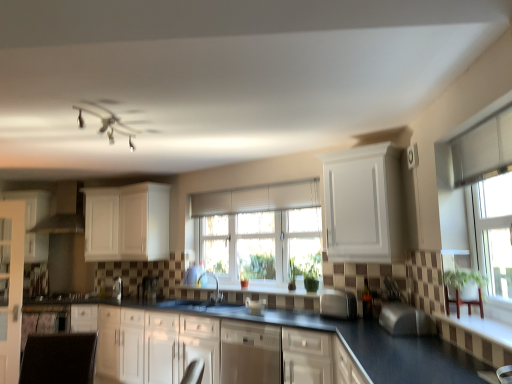
Question: Does satin black gas stove at lower left appear on the right side of satin silver toaster at center, positioned as the first appliance in back-to-front order?

Choices:
 (A) no
 (B) yes

Answer: (A)

Question: From a real-world perspective, is satin black gas stove at lower left on top of satin silver toaster at center, positioned as the first appliance in back-to-front order?

Choices:
 (A) no
 (B) yes

Answer: (A)

Question: From the image's perspective, is satin black gas stove at lower left beneath satin silver toaster at center, positioned as the first appliance in back-to-front order?

Choices:
 (A) yes
 (B) no

Answer: (A)

Question: Can you confirm if satin black gas stove at lower left is smaller than satin silver toaster at center, positioned as the first appliance in back-to-front order?

Choices:
 (A) yes
 (B) no

Answer: (B)

Question: Considering the relative sizes of satin black gas stove at lower left and satin silver toaster at center, positioned as the first appliance in back-to-front order, in the image provided, is satin black gas stove at lower left shorter than satin silver toaster at center, positioned as the first appliance in back-to-front order,?

Choices:
 (A) no
 (B) yes

Answer: (B)

Question: Could you tell me if satin black gas stove at lower left is facing satin silver toaster at center, which is counted as the first appliance, starting from the left?

Choices:
 (A) yes
 (B) no

Answer: (B)

Question: Is satin nickel faucet at center positioned in front of clear glass window at upper right, the first window positioned from the front?

Choices:
 (A) yes
 (B) no

Answer: (B)

Question: Is satin nickel faucet at center directly adjacent to clear glass window at upper right, which appears as the 1th window when viewed from the right?

Choices:
 (A) no
 (B) yes

Answer: (A)

Question: Can we say satin nickel faucet at center lies outside clear glass window at upper right, which appears as the 1th window when viewed from the right?

Choices:
 (A) yes
 (B) no

Answer: (A)

Question: Are satin nickel faucet at center and clear glass window at upper right, which is counted as the 2th window, starting from the left, far apart?

Choices:
 (A) no
 (B) yes

Answer: (B)

Question: From the image's perspective, is satin nickel faucet at center on top of clear glass window at upper right, the first window positioned from the front?

Choices:
 (A) yes
 (B) no

Answer: (B)

Question: From a real-world perspective, is satin nickel faucet at center below clear glass window at upper right, the first window positioned from the front?

Choices:
 (A) yes
 (B) no

Answer: (A)

Question: From the image's perspective, would you say white matte cabinet at upper left, marked as the 4th cabinetry in a right-to-left arrangement, is shown under satin black coffee machine at center?

Choices:
 (A) no
 (B) yes

Answer: (A)